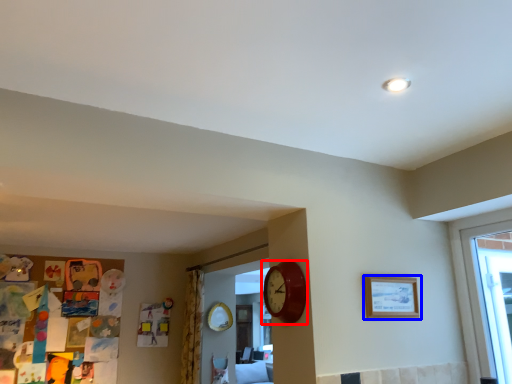
Question: Which object appears farthest to the camera in this image, wall clock (highlighted by a red box) or picture frame (highlighted by a blue box)?

Choices:
 (A) wall clock
 (B) picture frame

Answer: (B)